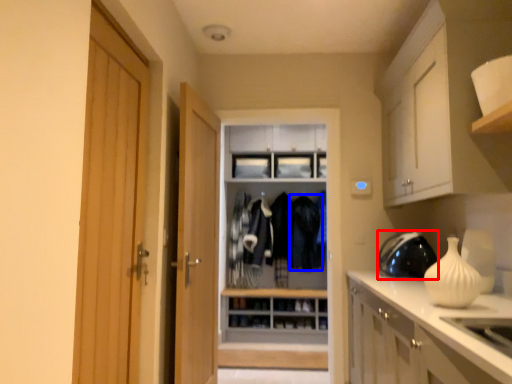
Question: Which point is closer to the camera, appliance (highlighted by a red box) or clothing (highlighted by a blue box)?

Choices:
 (A) appliance
 (B) clothing

Answer: (A)